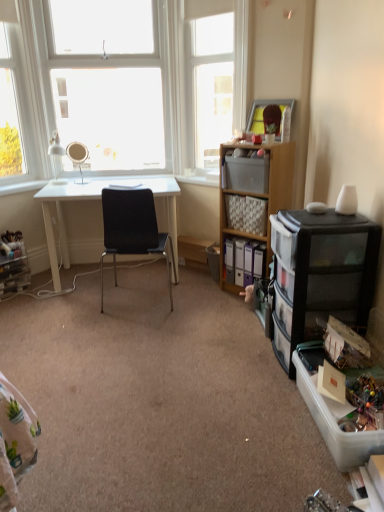
How much space does matte plastic storage box at center-right, the first storage box positioned from the top, occupy vertically?

8.46 inches.

The height and width of the screenshot is (512, 384). In order to click on matte plastic storage box at center-right, acting as the first storage box starting from the back in this screenshot , I will do `click(248, 174)`.

Measure the distance between point (x=65, y=194) and camera.

A distance of 3.04 meters exists between point (x=65, y=194) and camera.

The width and height of the screenshot is (384, 512). What do you see at coordinates (200, 176) in the screenshot?
I see `white plastic window sill at center` at bounding box center [200, 176].

At what (x,y) coordinates should I click in order to perform the action: click on matte plastic storage box at center-right, which is the second storage box in front-to-back order. Please return your answer as a coordinate pair (x, y). Looking at the image, I should click on (248, 174).

What's the angular difference between transparent glass window at upper center, which is the 1th window from right to left, and white glossy desk at center's facing directions?

transparent glass window at upper center, which is the 1th window from right to left, and white glossy desk at center are facing 48.2 degrees away from each other.

From a real-world perspective, relative to white glossy desk at center, is transparent glass window at upper center, acting as the third window starting from the left, vertically above or below?

transparent glass window at upper center, acting as the third window starting from the left, is above white glossy desk at center.

Which of these two, transparent glass window at upper center, acting as the third window starting from the left, or white glossy desk at center, is thinner?

Thinner between the two is transparent glass window at upper center, acting as the third window starting from the left.

Is there a large distance between transparent glass window at upper center, acting as the third window starting from the left, and white glossy desk at center?

That's not correct — transparent glass window at upper center, acting as the third window starting from the left, is a little close to white glossy desk at center.

Is matte silver mirror at upper left oriented towards black plastic drawer unit at right, marked as the 2th cabinetry in a back-to-front arrangement?

No, matte silver mirror at upper left is not aimed at black plastic drawer unit at right, marked as the 2th cabinetry in a back-to-front arrangement.

Is matte silver mirror at upper left not within black plastic drawer unit at right, marked as the 2th cabinetry in a back-to-front arrangement?

Yes.

Find the location of a particular element. The width and height of the screenshot is (384, 512). cabinetry that is the 2nd object to the right of the matte silver mirror at upper left, starting at the anchor is located at coordinates [325, 269].

Is white glass window at upper left, which is the 3th window in right-to-left order, oriented towards black plastic drawer unit at right, marked as the 2th cabinetry in a back-to-front arrangement?

Yes, white glass window at upper left, which is the 3th window in right-to-left order, faces towards black plastic drawer unit at right, marked as the 2th cabinetry in a back-to-front arrangement.

From the image's perspective, is white glass window at upper left, arranged as the first window when viewed from the left, on top of black plastic drawer unit at right, marked as the 2th cabinetry in a back-to-front arrangement?

Correct, white glass window at upper left, arranged as the first window when viewed from the left, appears higher than black plastic drawer unit at right, marked as the 2th cabinetry in a back-to-front arrangement, in the image.

Starting from the white glass window at upper left, which is the 3th window in right-to-left order, which cabinetry is the 2nd one to the right? Please provide its 2D coordinates.

[(325, 269)]

Who is smaller, white glossy lamp at upper left or transparent glass window at upper center, which is the 1th window from right to left?

Smaller between the two is white glossy lamp at upper left.

In the image, is white glossy lamp at upper left positioned in front of or behind transparent glass window at upper center, acting as the third window starting from the left?

Clearly, white glossy lamp at upper left is behind transparent glass window at upper center, acting as the third window starting from the left.

From a real-world perspective, relative to transparent glass window at upper center, acting as the third window starting from the left, is white glossy lamp at upper left vertically above or below?

From a real-world perspective, white glossy lamp at upper left is physically below transparent glass window at upper center, acting as the third window starting from the left.

Is white glossy lamp at upper left facing away from transparent glass window at upper center, which is the 1th window from right to left?

No, white glossy lamp at upper left is not facing away from transparent glass window at upper center, which is the 1th window from right to left.

Would you say white glossy lamp at upper left is to the left or to the right of black mesh chair at center in the picture?

In the image, white glossy lamp at upper left appears on the left side of black mesh chair at center.

Which of these two, white glossy lamp at upper left or black mesh chair at center, is bigger?

Bigger between the two is black mesh chair at center.

Does white glossy lamp at upper left touch black mesh chair at center?

white glossy lamp at upper left is not next to black mesh chair at center, and they're not touching.

Considering the relative sizes of white glossy lamp at upper left and black mesh chair at center in the image provided, is white glossy lamp at upper left wider than black mesh chair at center?

No.

At what (x,y) coordinates should I click in order to perform the action: click on the 1st shelf positioned below the white glossy lamp at upper left (from the image's perspective). Please return your answer as a coordinate pair (x, y). Image resolution: width=384 pixels, height=512 pixels. Looking at the image, I should click on (247, 214).

Can woven fabric basket at center-right, the 2th shelf from the bottom, be found inside white glossy lamp at upper left?

Definitely not — woven fabric basket at center-right, the 2th shelf from the bottom, is not inside white glossy lamp at upper left.

From a real-world perspective, relative to woven fabric basket at center-right, the first shelf in the right-to-left sequence, is white glossy lamp at upper left vertically above or below?

Clearly, from a real-world perspective, white glossy lamp at upper left is above woven fabric basket at center-right, the first shelf in the right-to-left sequence.

Which object is more forward, matte plastic storage box at center-right, which is the second storage box in front-to-back order, or transparent glass window at upper center, acting as the third window starting from the left?

matte plastic storage box at center-right, which is the second storage box in front-to-back order, is closer to the camera.

In terms of width, does matte plastic storage box at center-right, the first storage box positioned from the top, look wider or thinner when compared to transparent glass window at upper center, which is the 1th window from right to left?

Considering their sizes, matte plastic storage box at center-right, the first storage box positioned from the top, looks broader than transparent glass window at upper center, which is the 1th window from right to left.

Based on their positions, is matte plastic storage box at center-right, acting as the first storage box starting from the back, located to the left or right of transparent glass window at upper center, acting as the third window starting from the left?

From the image, it's evident that matte plastic storage box at center-right, acting as the first storage box starting from the back, is to the right of transparent glass window at upper center, acting as the third window starting from the left.

Between point (227, 170) and point (215, 95), which one is positioned behind?

Point (215, 95)

You are a GUI agent. You are given a task and a screenshot of the screen. Output one action in this format:
    pyautogui.click(x=<x>, y=<y>)
    Task: Click on the desk lying behind the transparent glass window at upper center, acting as the third window starting from the left
    The width and height of the screenshot is (384, 512).
    Given the screenshot: What is the action you would take?
    pyautogui.click(x=63, y=216)

The width and height of the screenshot is (384, 512). I want to click on cabinetry that is the 2nd one below the matte silver mirror at upper left (from a real-world perspective), so click(325, 269).

Estimate the real-world distances between objects in this image. Which object is further from wooden cabinet at center right, arranged as the first cabinetry when viewed from the back, white plastic window sill at center or white glass window at upper left, placed as the 2th window when sorted from right to left?

white glass window at upper left, placed as the 2th window when sorted from right to left, is positioned further to the anchor wooden cabinet at center right, arranged as the first cabinetry when viewed from the back.

From the image, which object appears to be nearer to transparent glass window at upper center, which is the 1th window from right to left, matte plastic storage box at center-right, which is the second storage box in front-to-back order, or white glossy desk at center?

matte plastic storage box at center-right, which is the second storage box in front-to-back order, is closer to transparent glass window at upper center, which is the 1th window from right to left.

Estimate the real-world distances between objects in this image. Which object is closer to white plastic window sill at center, woven fabric basket at center-right, the first shelf in the right-to-left sequence, or black plastic drawer unit at right, marked as the 2th cabinetry in a back-to-front arrangement?

Among the two, woven fabric basket at center-right, the first shelf in the right-to-left sequence, is located nearer to white plastic window sill at center.

Based on their spatial positions, is wooden picture frame at upper right or clear plastic storage box at lower right, marked as the 2th storage box in a top-to-bottom arrangement, further from matte plastic storage box at center-right, the first storage box positioned from the top?

clear plastic storage box at lower right, marked as the 2th storage box in a top-to-bottom arrangement, is further to matte plastic storage box at center-right, the first storage box positioned from the top.

Based on their spatial positions, is transparent glass window at upper center, which is the 1th window from right to left, or wooden picture frame at upper right closer to white glossy desk at center?

transparent glass window at upper center, which is the 1th window from right to left, lies closer to white glossy desk at center than the other object.

Considering their positions, is wooden cabinet at center right, which appears as the second cabinetry when viewed from the front, positioned further to clear plastic storage box at lower right, marked as the 2th storage box in a back-to-front arrangement, than white glass window at upper left, which is the 3th window in right-to-left order?

Based on the image, white glass window at upper left, which is the 3th window in right-to-left order, appears to be further to clear plastic storage box at lower right, marked as the 2th storage box in a back-to-front arrangement.

Estimate the real-world distances between objects in this image. Which object is further from white glossy lamp at upper left, black mesh chair at center or woven fabric basket at center-right, the first shelf when ordered from top to bottom?

woven fabric basket at center-right, the first shelf when ordered from top to bottom, is further to white glossy lamp at upper left.

Which object lies further to the anchor point black plastic drawer unit at right, positioned as the 1th cabinetry in front-to-back order, clear plastic drawers at lower left, the 1th shelf in the left-to-right sequence, or wooden picture frame at upper right?

clear plastic drawers at lower left, the 1th shelf in the left-to-right sequence, is further to black plastic drawer unit at right, positioned as the 1th cabinetry in front-to-back order.

Where is `picture frame between matte plastic storage box at center-right, the first storage box positioned from the top, and white plastic window sill at center in the front-back direction`? This screenshot has height=512, width=384. picture frame between matte plastic storage box at center-right, the first storage box positioned from the top, and white plastic window sill at center in the front-back direction is located at coordinates (263, 113).

Identify the location of cabinetry between clear plastic drawers at lower left, the 1th shelf in the left-to-right sequence, and black plastic drawer unit at right, marked as the 2th cabinetry in a back-to-front arrangement, from left to right. (256, 192).

Identify the location of desk between clear plastic drawers at lower left, positioned as the second shelf in right-to-left order, and white plastic window sill at center, in the horizontal direction. (63, 216).

You are a GUI agent. You are given a task and a screenshot of the screen. Output one action in this format:
    pyautogui.click(x=<x>, y=<y>)
    Task: Click on the mirror situated between white glass window at upper left, arranged as the first window when viewed from the left, and white plastic window sill at center from left to right
    The image size is (384, 512).
    Given the screenshot: What is the action you would take?
    pyautogui.click(x=78, y=157)